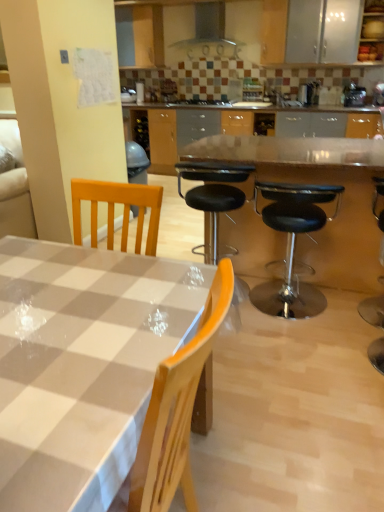
Question: Is transparent glass table at center in front of or behind black leather stool at center, the second chair in the left-to-right sequence, in the image?

Choices:
 (A) behind
 (B) front

Answer: (A)

Question: In terms of size, does transparent glass table at center appear bigger or smaller than black leather stool at center, marked as the 1th chair in a right-to-left arrangement?

Choices:
 (A) big
 (B) small

Answer: (A)

Question: Which is farther from the black leather stool at center, marked as the first chair in a left-to-right arrangement?

Choices:
 (A) wooden cabinet at upper right
 (B) black glass gas stove at center
 (C) checkered plastic table at center
 (D) transparent glass table at center
 (E) metallic gray exhaust hood at upper center

Answer: (E)

Question: Which object is the closest to the black leather bar stool at right?

Choices:
 (A) checkered plastic table at center
 (B) metallic gray exhaust hood at upper center
 (C) metallic silver toaster at upper right
 (D) black glass gas stove at center
 (E) black leather stool at center, marked as the first chair in a left-to-right arrangement

Answer: (E)